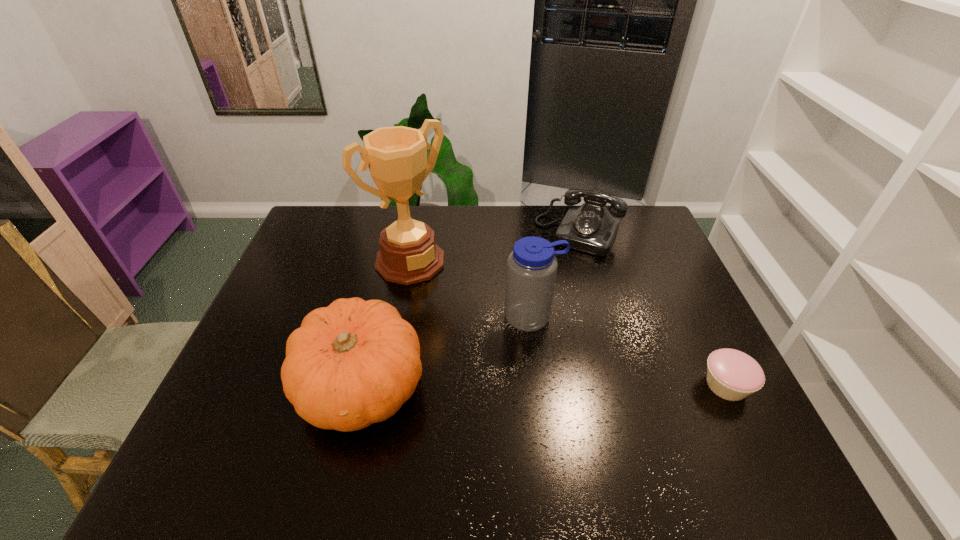
Where is `free space located 0.210m on the front-facing side of the tallest object`? This screenshot has height=540, width=960. free space located 0.210m on the front-facing side of the tallest object is located at coordinates (472, 319).

The width and height of the screenshot is (960, 540). Find the location of `vacant space located 0.190m on the front-facing side of the tallest object`. vacant space located 0.190m on the front-facing side of the tallest object is located at coordinates (468, 315).

At what (x,y) coordinates should I click in order to perform the action: click on free space located with a carrying loop on the side of the water bottle. Please return your answer as a coordinate pair (x, y). Image resolution: width=960 pixels, height=540 pixels. Looking at the image, I should click on (566, 418).

This screenshot has height=540, width=960. Identify the location of vacant area located 0.050m with a carrying loop on the side of the water bottle. (543, 348).

This screenshot has width=960, height=540. I want to click on vacant space located 0.060m with a carrying loop on the side of the water bottle, so click(x=544, y=351).

Identify the location of free space located 0.360m on the dial of the telephone. coord(527,329).

Locate an element on the screen. This screenshot has height=540, width=960. free space located on the dial of the telephone is located at coordinates (555, 275).

Identify the location of blank space located 0.280m on the dial of the telephone. (537, 310).

Where is `award that is at the far edge`? award that is at the far edge is located at coordinates (396, 156).

Locate an element on the screen. The width and height of the screenshot is (960, 540). telephone that is at the far edge is located at coordinates (590, 228).